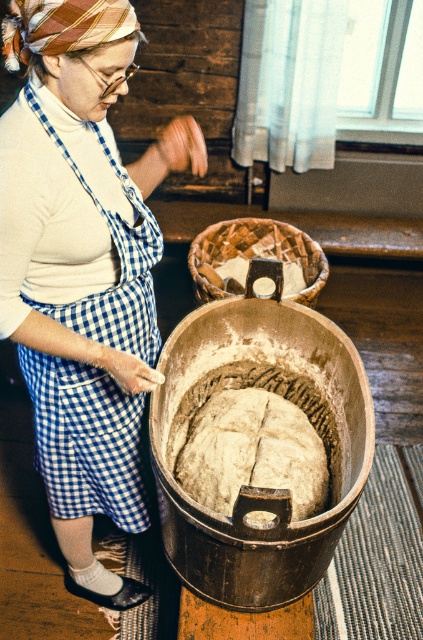
Question: Which point is closer to the camera?

Choices:
 (A) white turtleneck at center
 (B) wooden bowl at center
 (C) spongy dough at center

Answer: (A)

Question: Can you confirm if white turtleneck at center is wider than woven wood basket at center?

Choices:
 (A) no
 (B) yes

Answer: (A)

Question: Is wooden bowl at center bigger than woven wood basket at center?

Choices:
 (A) yes
 (B) no

Answer: (A)

Question: Does white turtleneck at center appear on the right side of spongy dough at center?

Choices:
 (A) no
 (B) yes

Answer: (A)

Question: Considering the real-world distances, which object is closest to the wooden bowl at center?

Choices:
 (A) spongy dough at center
 (B) white turtleneck at center

Answer: (A)

Question: Among these points, which one is farthest from the camera?

Choices:
 (A) (249, 364)
 (B) (153, 150)
 (C) (357, 406)

Answer: (A)